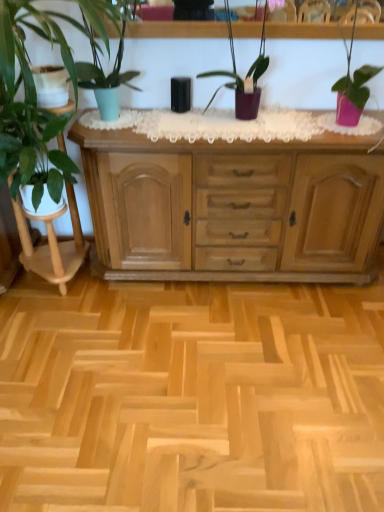
You are a GUI agent. You are given a task and a screenshot of the screen. Output one action in this format:
    pyautogui.click(x=<x>, y=<y>)
    Task: Click on the vacant space in front of white glossy plant stand at left
    This screenshot has height=512, width=384.
    Given the screenshot: What is the action you would take?
    pyautogui.click(x=57, y=321)